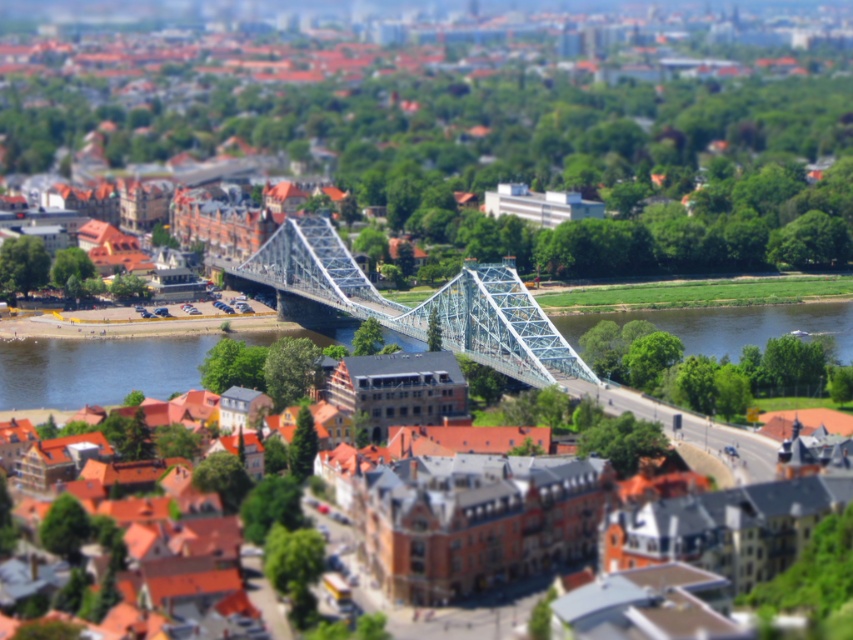
You are a city planner reviewing this urban landscape. You need to determine the positioning of the blue metallic river at center and the blue metallic bridge at center. Which object is located to the right of the other?

The blue metallic river at center is to the right of the blue metallic bridge at center.

You are a boat captain planning to navigate your vessel through the blue metallic bridge at center. Based on the scene, can you determine if the blue metallic river at center is wide enough to allow your boat to pass under the bridge?

The blue metallic river at center is wider than the blue metallic bridge at center, so the boat can safely pass under the bridge.